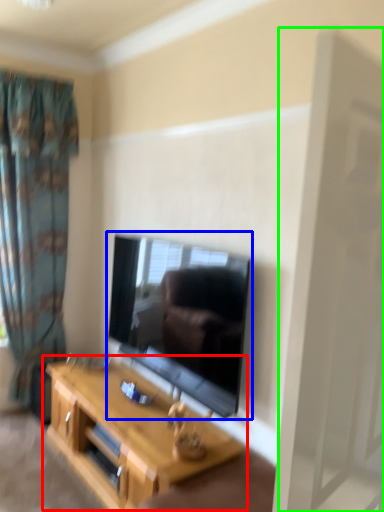
Question: Based on their relative distances, which object is farther from table (highlighted by a red box)? Choose from television (highlighted by a blue box) and screen door (highlighted by a green box).

Choices:
 (A) television
 (B) screen door

Answer: (B)